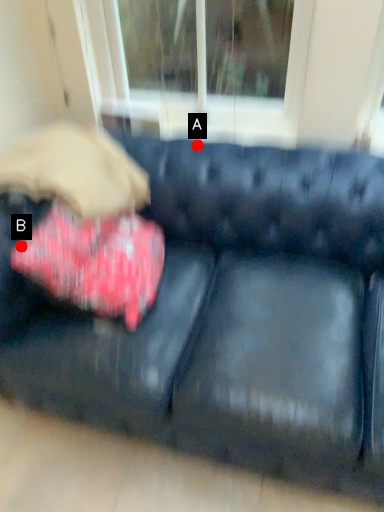
Question: Two points are circled on the image, labeled by A and B beside each circle. Among these points, which one is farthest from the camera?

Choices:
 (A) A is further
 (B) B is further

Answer: (A)